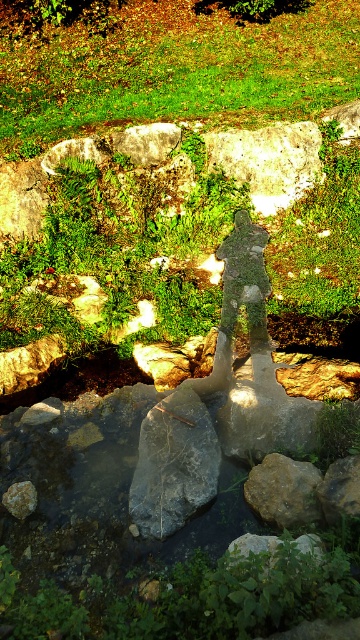
Question: Is green grass at upper center positioned at the back of gray/rough stone at center?

Choices:
 (A) yes
 (B) no

Answer: (A)

Question: Which point is farther to the camera?

Choices:
 (A) green grass at upper center
 (B) smooth gray rock at lower left
 (C) brown rough rock at center
 (D) green leafy grass at center

Answer: (A)

Question: Is gray/rough stone at center bigger than smooth gray rock at lower left?

Choices:
 (A) no
 (B) yes

Answer: (B)

Question: Considering the real-world distances, which object is farthest from the smooth gray rock at lower left?

Choices:
 (A) brown rough rock at center
 (B) rough textured rock at center
 (C) green leafy grass at center

Answer: (C)

Question: Does gray/rough stone at center have a smaller size compared to smooth gray rock at lower left?

Choices:
 (A) yes
 (B) no

Answer: (B)

Question: Which of the following is the closest to the observer?

Choices:
 (A) gray/rough stone at center
 (B) green grass at upper center

Answer: (A)